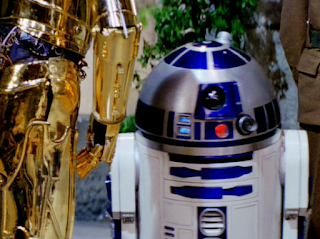
Where is `plant`? plant is located at coordinates (174, 22).